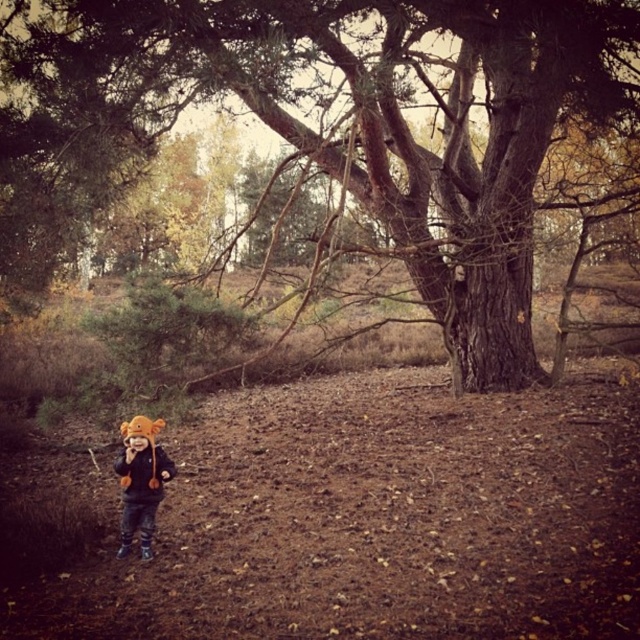
You are a photographer trying to capture the child in the forest scene. You notice the brown fuzzy hat at lower left and the orange fuzzy jacket at lower left. Which object would appear narrower when focusing on the child?

The brown fuzzy hat at lower left is thinner than the orange fuzzy jacket at lower left, so it would appear narrower when focusing on the child.

Based on the photo, you are a bird flying over a forest and want to land on the brown rough bark tree at center. Based on the coordinates provided, can you determine if the tree is located in the upper half of the image?

The brown rough bark tree at center is located at coordinates point (348,122). Since the y coordinate is 0.544, which is above the midpoint of 0.5, the tree is in the upper half of the image.

You are a photographer trying to capture the child in the forest scene. You notice the brown fuzzy hat at lower left and the orange fuzzy jacket at lower left. Which object should you focus on first if you want to ensure both are in sharp focus?

You should focus on the orange fuzzy jacket at lower left first because the brown fuzzy hat at lower left is positioned under it, meaning the jacket is closer to the camera. Focusing on the closer object ensures both will be in focus if using a shallow depth of field.